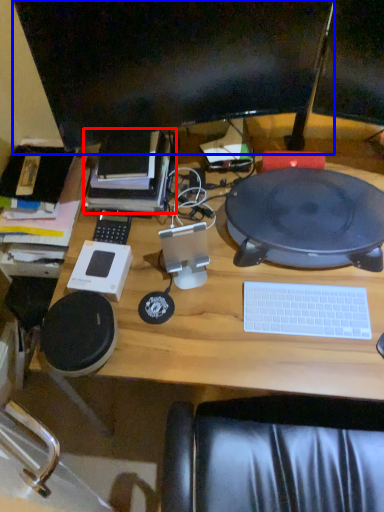
Question: Which object appears closest to the camera in this image, book (highlighted by a red box) or computer monitor (highlighted by a blue box)?

Choices:
 (A) book
 (B) computer monitor

Answer: (B)